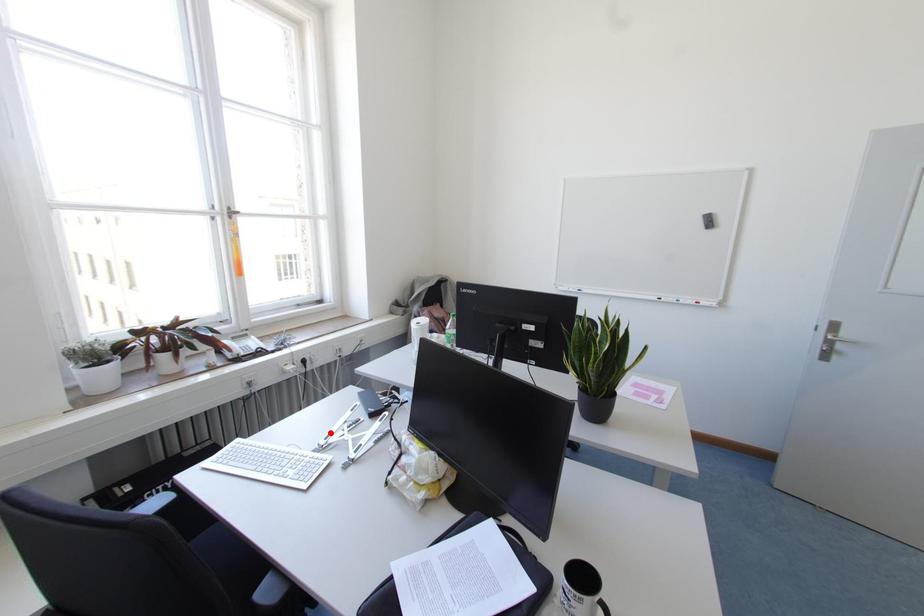
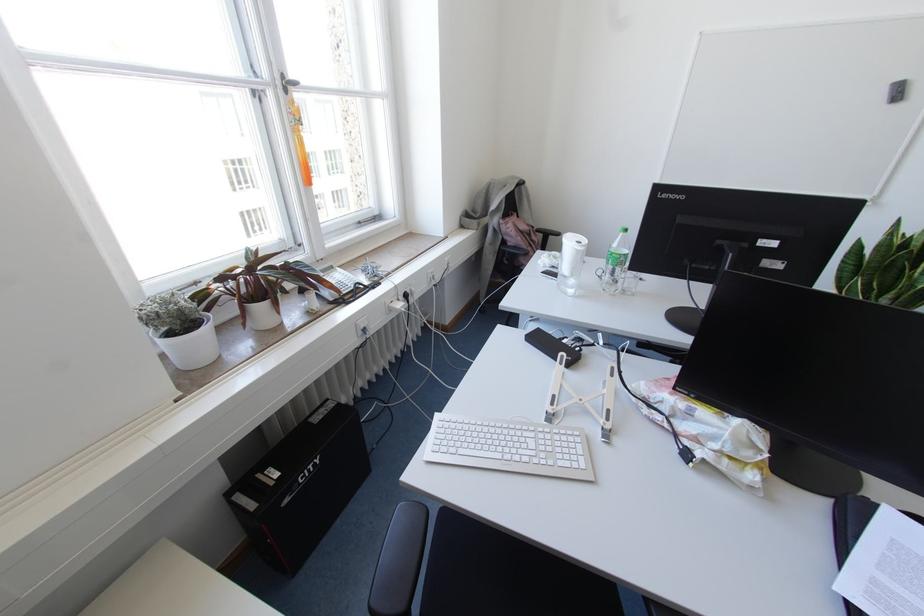
Question: I am providing you with two images of the same scene from different viewpoints. Image1 has a red point marked. In image2, the corresponding 3D location appears at what relative position? Reply with the corresponding letter.

Choices:
 (A) Closer
 (B) Farther

Answer: (A)